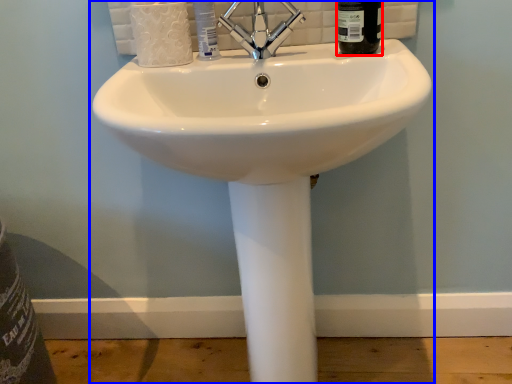
Question: Which object appears farthest to the camera in this image, liquid (highlighted by a red box) or sink (highlighted by a blue box)?

Choices:
 (A) liquid
 (B) sink

Answer: (A)